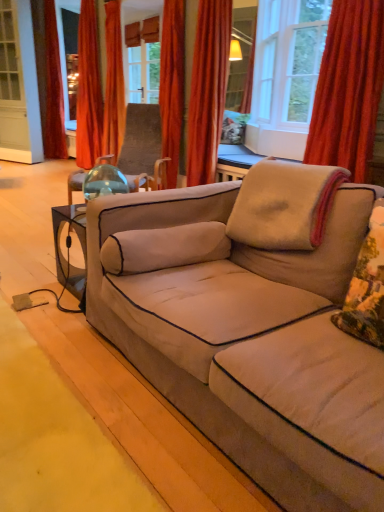
Identify the location of velvet red curtain at left, placed as the first curtain when sorted from back to front. This screenshot has width=384, height=512. (49, 78).

Measure the distance between point (32, 9) and camera.

A distance of 5.51 meters exists between point (32, 9) and camera.

The width and height of the screenshot is (384, 512). What do you see at coordinates (251, 323) in the screenshot? I see `beige fabric couch at center` at bounding box center [251, 323].

How much space does beige soft pillow at upper right, the second pillow in the front-to-back sequence, occupy horizontally?

beige soft pillow at upper right, the second pillow in the front-to-back sequence, is 21.29 inches wide.

At what (x,y) coordinates should I click in order to perform the action: click on orange velvet curtain at upper left, the 4th curtain viewed from the right. Please return your answer as a coordinate pair (x, y). The width and height of the screenshot is (384, 512). Looking at the image, I should click on (88, 90).

From a real-world perspective, is velvet orange curtain at upper center, the 4th curtain when ordered from back to front, physically below orange velvet curtain at upper center, which appears as the 3th curtain when viewed from the front?

Indeed, from a real-world perspective, velvet orange curtain at upper center, the 4th curtain when ordered from back to front, is positioned beneath orange velvet curtain at upper center, which appears as the 3th curtain when viewed from the front.

Considering the positions of objects velvet orange curtain at upper center, arranged as the 2th curtain when viewed from the front, and orange velvet curtain at upper center, the third curtain when ordered from left to right, in the image provided, who is more to the right, velvet orange curtain at upper center, arranged as the 2th curtain when viewed from the front, or orange velvet curtain at upper center, the third curtain when ordered from left to right,?

velvet orange curtain at upper center, arranged as the 2th curtain when viewed from the front, is more to the right.

Is point (196, 54) farther from camera compared to point (119, 143)?

That is False.

From the image's perspective, which one is positioned higher, velvet orange curtain at upper center, placed as the 4th curtain when sorted from left to right, or orange velvet curtain at upper center, the third curtain when ordered from left to right?

orange velvet curtain at upper center, the third curtain when ordered from left to right, appears higher in the image.

Based on the photo, which is more to the right, velvet orange curtain at upper center, the 4th curtain when ordered from back to front, or fluffy beige pillow at right, which is the first pillow in front-to-back order?

fluffy beige pillow at right, which is the first pillow in front-to-back order.

Consider the image. Relative to fluffy beige pillow at right, which is the first pillow in front-to-back order, is velvet orange curtain at upper center, placed as the 4th curtain when sorted from left to right, in front or behind?

Visually, velvet orange curtain at upper center, placed as the 4th curtain when sorted from left to right, is located behind fluffy beige pillow at right, which is the first pillow in front-to-back order.

Is velvet orange curtain at upper center, the 2th curtain when ordered from right to left, touching fluffy beige pillow at right, the second pillow in the back-to-front sequence?

No, velvet orange curtain at upper center, the 2th curtain when ordered from right to left, is not making contact with fluffy beige pillow at right, the second pillow in the back-to-front sequence.

Find the location of a particular element. the 1st curtain counting from the left of the fluffy beige pillow at right, the second pillow in the back-to-front sequence is located at coordinates (208, 89).

Is transparent glass chair at center taller than fluffy beige pillow at right, the second pillow in the back-to-front sequence?

Correct, transparent glass chair at center is much taller as fluffy beige pillow at right, the second pillow in the back-to-front sequence.

Is the depth of transparent glass chair at center less than that of fluffy beige pillow at right, the second pillow in the back-to-front sequence?

No, transparent glass chair at center is behind fluffy beige pillow at right, the second pillow in the back-to-front sequence.

At what (x,y) coordinates should I click in order to perform the action: click on pillow that is the 2nd one below the transparent glass chair at center (from a real-world perspective). Please return your answer as a coordinate pair (x, y). This screenshot has height=512, width=384. Looking at the image, I should click on (367, 287).

Is transparent glass chair at center not close to fluffy beige pillow at right, the second pillow in the back-to-front sequence?

transparent glass chair at center is far away from fluffy beige pillow at right, the second pillow in the back-to-front sequence.

Consider the image. How much distance is there between velvet red curtain at left, which is counted as the fifth curtain, starting from the right, and orange velvet curtain at upper center, the third curtain when ordered from left to right?

velvet red curtain at left, which is counted as the fifth curtain, starting from the right, is 4.22 feet away from orange velvet curtain at upper center, the third curtain when ordered from left to right.

Which object is further away from the camera, velvet red curtain at left, the fifth curtain positioned from the front, or orange velvet curtain at upper center, placed as the third curtain when sorted from right to left?

velvet red curtain at left, the fifth curtain positioned from the front.

Is point (50, 23) behind point (107, 109)?

Yes, it is behind point (107, 109).

From a real-world perspective, between velvet red curtain at left, which ranks as the 1th curtain in left-to-right order, and orange velvet curtain at upper center, the third curtain when ordered from left to right, who is vertically lower?

In real-world perspective, orange velvet curtain at upper center, the third curtain when ordered from left to right, is lower.

Would you say velvet orange curtain at upper right, positioned as the 1th curtain in right-to-left order, contains wooden paneling at upper center?

No, velvet orange curtain at upper right, positioned as the 1th curtain in right-to-left order, does not contain wooden paneling at upper center.

From the image's perspective, does velvet orange curtain at upper right, the fifth curtain when ordered from back to front, appear lower than wooden paneling at upper center?

Correct, velvet orange curtain at upper right, the fifth curtain when ordered from back to front, appears lower than wooden paneling at upper center in the image.

Which object is positioned more to the left, velvet orange curtain at upper right, marked as the fifth curtain in a left-to-right arrangement, or wooden paneling at upper center?

From the viewer's perspective, wooden paneling at upper center appears more on the left side.

The height and width of the screenshot is (512, 384). I want to click on chair on the left of beige soft pillow at upper right, arranged as the first pillow when viewed from the back, so click(143, 148).

Based on the photo, which is further, (154, 172) or (287, 182)?

Point (154, 172)

From a real-world perspective, is transparent glass chair at center physically below beige soft pillow at upper right, the second pillow in the front-to-back sequence?

No, from a real-world perspective, transparent glass chair at center is not beneath beige soft pillow at upper right, the second pillow in the front-to-back sequence.

Is point (133, 166) behind point (220, 109)?

Yes, point (133, 166) is farther from viewer.

Is velvet orange curtain at upper center, arranged as the 2th curtain when viewed from the front, surrounded by transparent glass chair at center?

That's incorrect, velvet orange curtain at upper center, arranged as the 2th curtain when viewed from the front, is not inside transparent glass chair at center.

Relative to velvet orange curtain at upper center, placed as the 4th curtain when sorted from left to right, is transparent glass chair at center in front or behind?

transparent glass chair at center is positioned closer to the viewer than velvet orange curtain at upper center, placed as the 4th curtain when sorted from left to right.

Find the location of a particular element. the 1st curtain in front of the orange velvet curtain at upper center, which appears as the 3th curtain when viewed from the front is located at coordinates (208, 89).

Which curtain is the 2nd one when counting from the back of the fluffy beige pillow at right, which is the first pillow in front-to-back order? Please provide its 2D coordinates.

[(208, 89)]

Which object lies nearer to the anchor point fluffy beige pillow at right, the second pillow in the back-to-front sequence, transparent glass chair at center or velvet orange curtain at upper center, the 4th curtain when ordered from back to front?

transparent glass chair at center.

From the image, which object appears to be nearer to velvet red curtain at left, placed as the first curtain when sorted from back to front, beige fabric couch at center or transparent glass chair at center?

Among the two, transparent glass chair at center is located nearer to velvet red curtain at left, placed as the first curtain when sorted from back to front.

From the image, which object appears to be nearer to velvet orange curtain at upper center, placed as the 4th curtain when sorted from left to right, wooden paneling at upper center or transparent glass chair at center?

The object closer to velvet orange curtain at upper center, placed as the 4th curtain when sorted from left to right, is transparent glass chair at center.

From the image, which object appears to be nearer to beige fabric couch at center, beige soft pillow at upper right, arranged as the first pillow when viewed from the back, or orange velvet curtain at upper left, the 4th curtain viewed from the right?

beige soft pillow at upper right, arranged as the first pillow when viewed from the back, is positioned closer to the anchor beige fabric couch at center.

Based on their spatial positions, is velvet orange curtain at upper center, the 4th curtain when ordered from back to front, or fluffy beige pillow at right, which is the first pillow in front-to-back order, further from velvet red curtain at left, the fifth curtain positioned from the front?

fluffy beige pillow at right, which is the first pillow in front-to-back order, is further to velvet red curtain at left, the fifth curtain positioned from the front.

Considering their positions, is velvet orange curtain at upper center, arranged as the 2th curtain when viewed from the front, positioned further to velvet orange curtain at upper right, the fifth curtain when ordered from back to front, than velvet red curtain at left, the fifth curtain positioned from the front?

Among the two, velvet red curtain at left, the fifth curtain positioned from the front, is located further to velvet orange curtain at upper right, the fifth curtain when ordered from back to front.

Based on their spatial positions, is velvet red curtain at left, placed as the first curtain when sorted from back to front, or velvet orange curtain at upper right, positioned as the 1th curtain in right-to-left order, closer to fluffy beige pillow at right, which is the first pillow in front-to-back order?

velvet orange curtain at upper right, positioned as the 1th curtain in right-to-left order, lies closer to fluffy beige pillow at right, which is the first pillow in front-to-back order, than the other object.

Estimate the real-world distances between objects in this image. Which object is closer to velvet orange curtain at upper center, placed as the 4th curtain when sorted from left to right, wooden paneling at upper center or orange velvet curtain at upper center, placed as the third curtain when sorted from right to left?

The object closer to velvet orange curtain at upper center, placed as the 4th curtain when sorted from left to right, is wooden paneling at upper center.

This screenshot has width=384, height=512. Find the location of `chair between beige soft pillow at upper right, the second pillow in the front-to-back sequence, and wooden paneling at upper center from front to back`. chair between beige soft pillow at upper right, the second pillow in the front-to-back sequence, and wooden paneling at upper center from front to back is located at coordinates (143, 148).

Identify the location of pillow between fluffy beige pillow at right, the second pillow in the back-to-front sequence, and velvet orange curtain at upper right, positioned as the 1th curtain in right-to-left order, along the z-axis. This screenshot has height=512, width=384. (284, 205).

Identify the location of chair between beige fabric couch at center and velvet orange curtain at upper center, arranged as the 2th curtain when viewed from the front, in the front-back direction. This screenshot has width=384, height=512. (143, 148).

Identify the location of curtain between orange velvet curtain at upper center, the third curtain when ordered from back to front, and velvet red curtain at left, the fifth curtain positioned from the front, from front to back. The width and height of the screenshot is (384, 512). (88, 90).